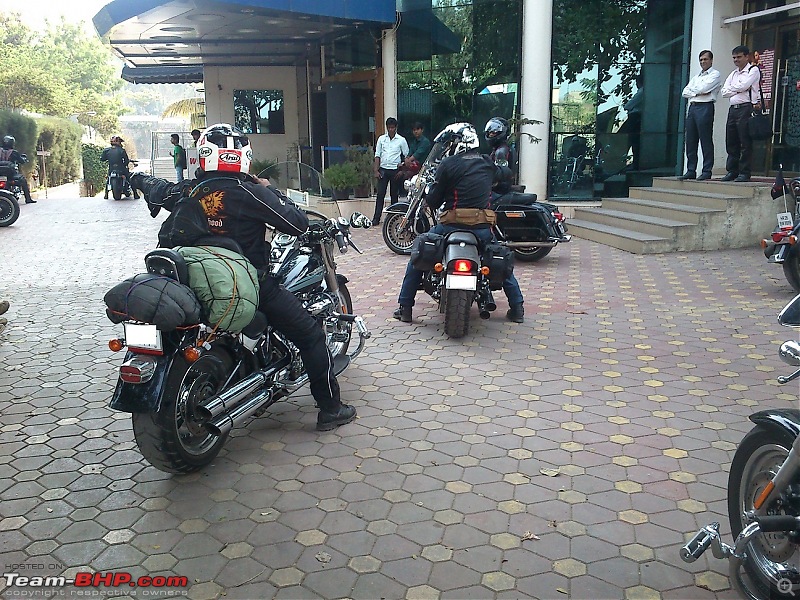
The height and width of the screenshot is (600, 800). In order to click on windows of building in this screenshot , I will do (x=586, y=94), (x=488, y=88).